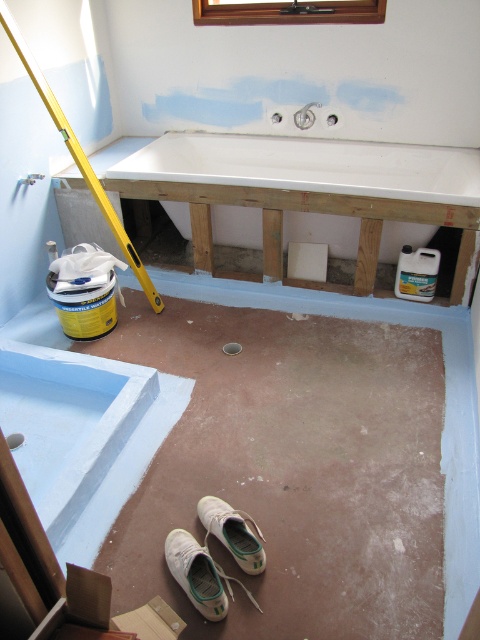
You are a contractor working in the bathroom and need to place both the white canvas shoe at lower center and the white fabric shoe at lower center on a shelf that can only hold items narrower than 10 inches. Which shoe can you safely place on the shelf?

The white canvas shoe at lower center has a width less than the white fabric shoe at lower center, so the white canvas shoe at lower center can be safely placed on the shelf since it is narrower than 10 inches.

You are a contractor standing in the bathroom and need to install a new faucet on the white glossy sink at center. If your ladder is 6 feet tall, can you safely reach the sink to install the faucet without needing a taller ladder?

The white glossy sink at center is 7.44 feet away from the viewer. Since the ladder is only 6 feet tall, it is not tall enough to safely reach the sink for installation. A taller ladder would be required.

You are a contractor inspecting the bathroom renovation. You notice the white glossy sink at center and the white canvas shoe at lower center. Which object is taller?

The white glossy sink at center is taller than the white canvas shoe at lower center.